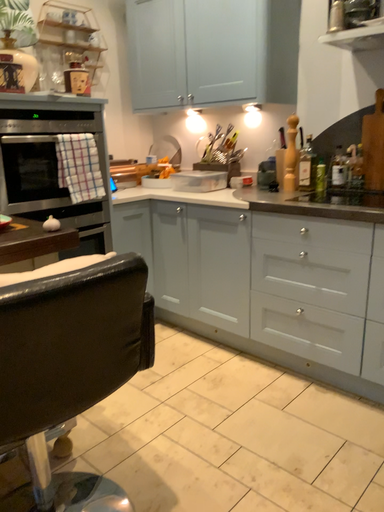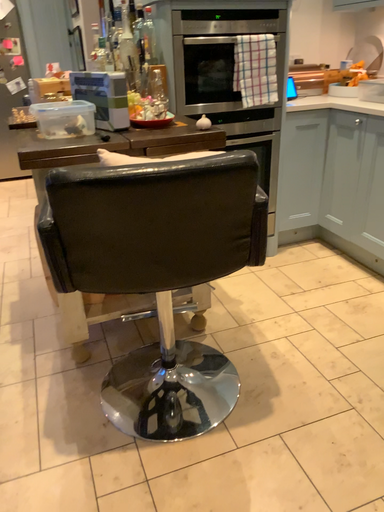
Question: Which way did the camera rotate in the video?

Choices:
 (A) rotated right
 (B) rotated left

Answer: (B)